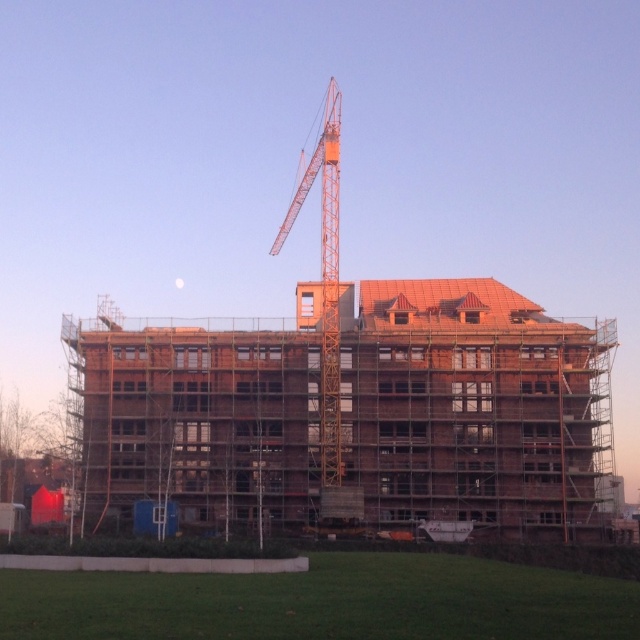
You are a construction worker standing at the base of the orange metallic crane at center. You need to deliver materials to the brown wooden building at center. Can you see the building from your current position?

Yes, the brown wooden building at center is in front of the orange metallic crane at center, so you can see it from your position at the base of the crane.

You are an architect observing the construction site. You need to determine the spatial relationship between the brown wooden building at center and the orange metallic crane at center. Which object is positioned higher relative to the other?

The brown wooden building at center is located below the orange metallic crane at center, meaning the orange metallic crane at center is positioned higher.

You are an architect observing the construction site. You need to determine if the brown wooden building at center can be seen from the top of the orange metallic crane at center. Based on their heights, what is your conclusion?

The brown wooden building at center is shorter than the orange metallic crane at center, so yes, the building can be seen from the top of the crane because it is shorter and does not obstruct the view.